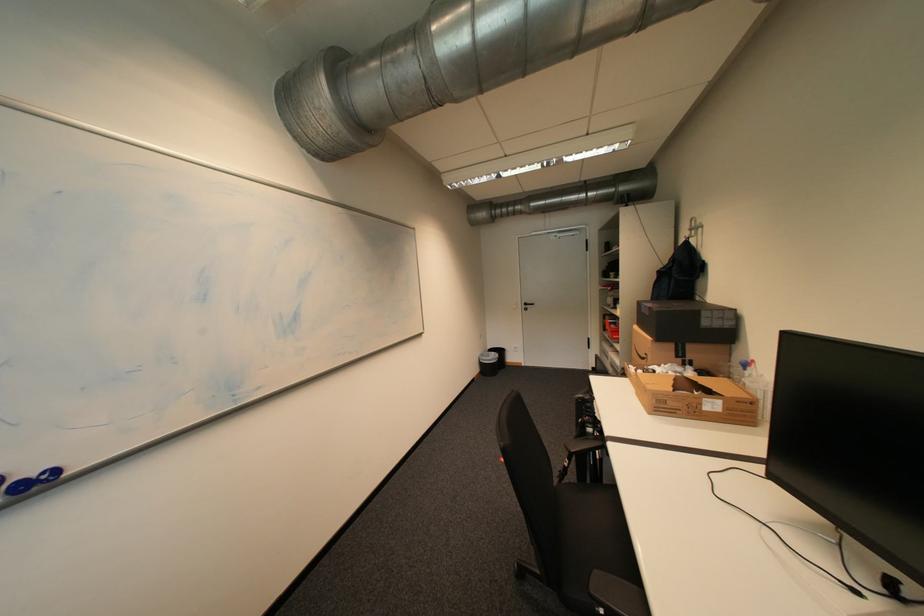
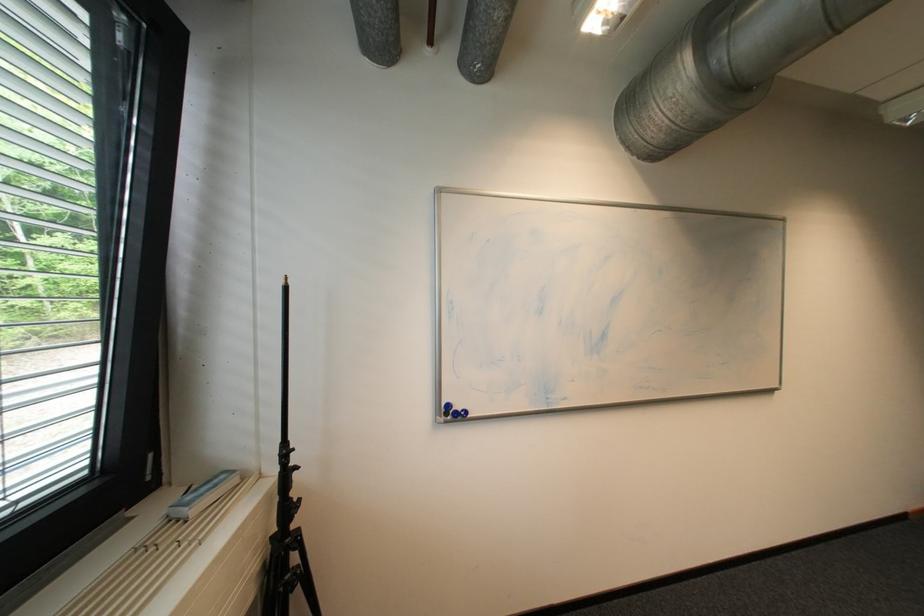
Locate, in the second image, the point that corresponds to [43,476] in the first image.

(468, 410)